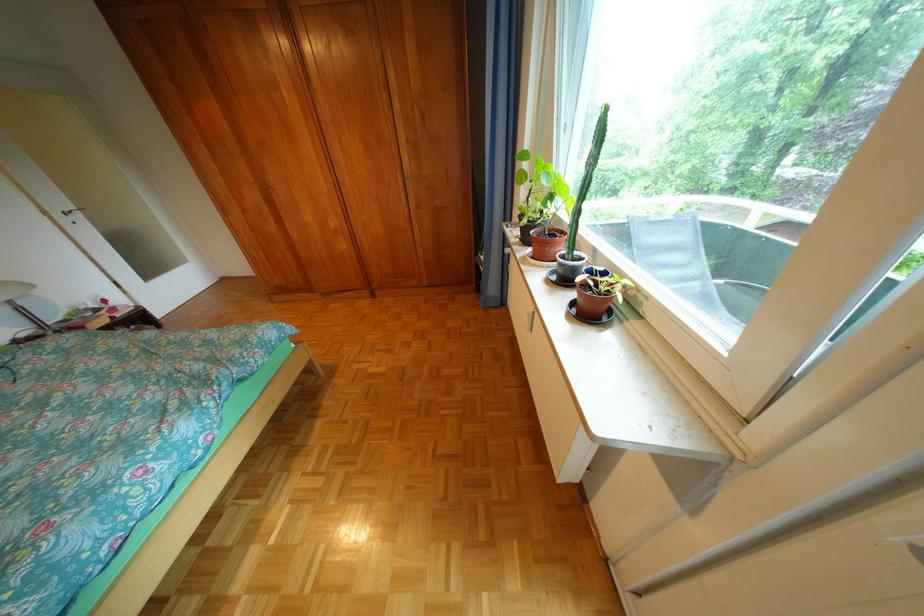
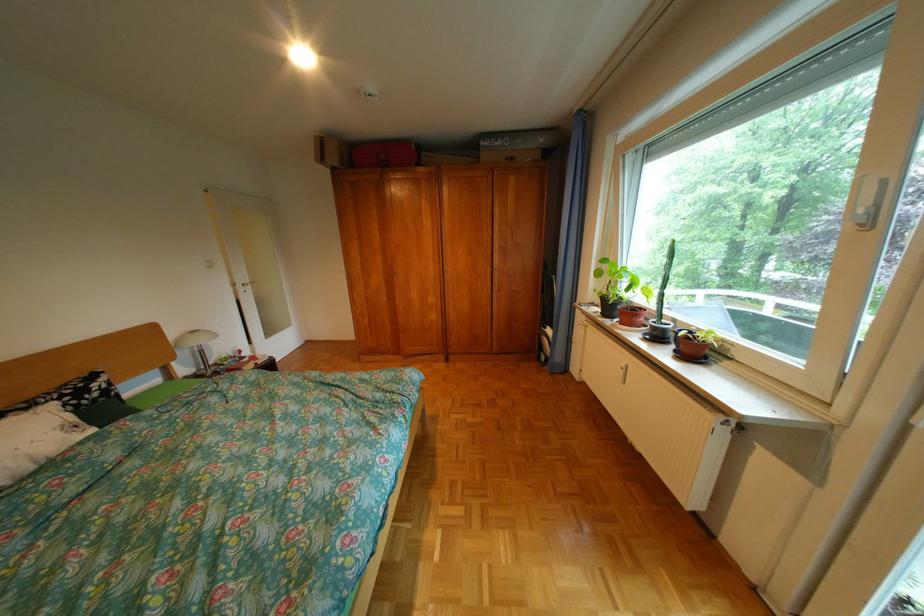
Based on the photo, in a continuous first-person perspective shot, in which direction is the camera moving?

The cameraman walked toward left, backward.